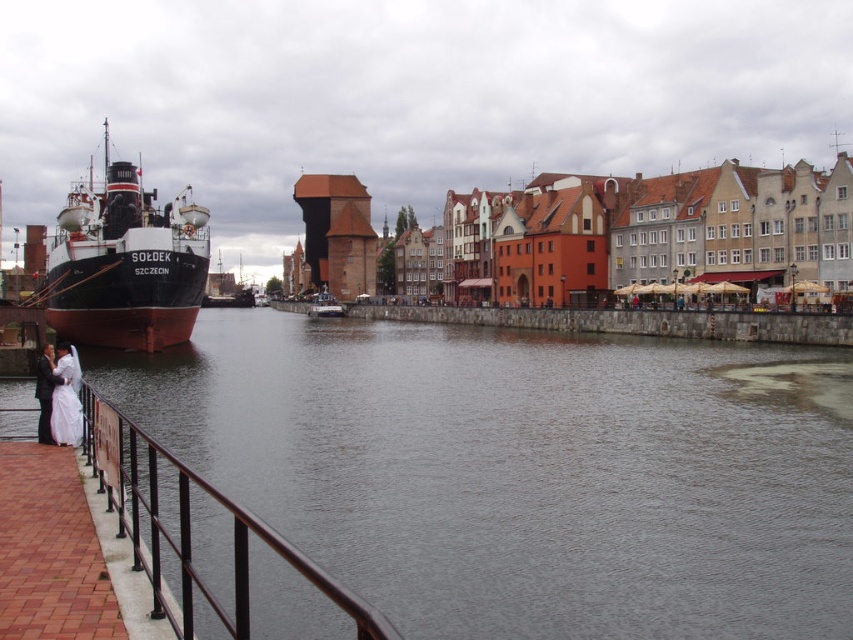
You are standing at the point closer to the camera in this riverside scene. Which point are you at, point (x=189, y=584) or point (x=76, y=442)?

You are at point (x=189, y=584) because it is closer to the camera than point (x=76, y=442).

You are a photographer positioned at the riverside scene. You need to capture a photo that includes both the black metal railing at lower left and the white satin dress at lower left. Which object should be placed closer to the camera to ensure both are in focus?

The black metal railing at lower left has a larger size compared to the white satin dress at lower left. To ensure both are in focus, the photographer should place the larger object, the black metal railing at lower left, closer to the camera.